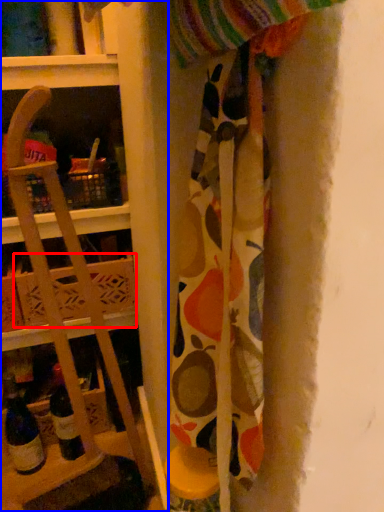
Question: Which object is further to the camera taking this photo, cardboard box (highlighted by a red box) or shelf (highlighted by a blue box)?

Choices:
 (A) cardboard box
 (B) shelf

Answer: (A)